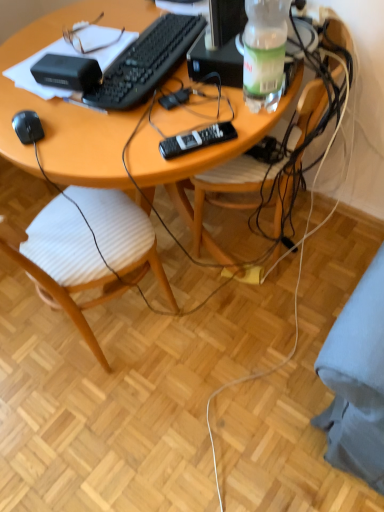
Locate an element on the screen. vacant position to the left of black matte keyboard at center is located at coordinates (29, 91).